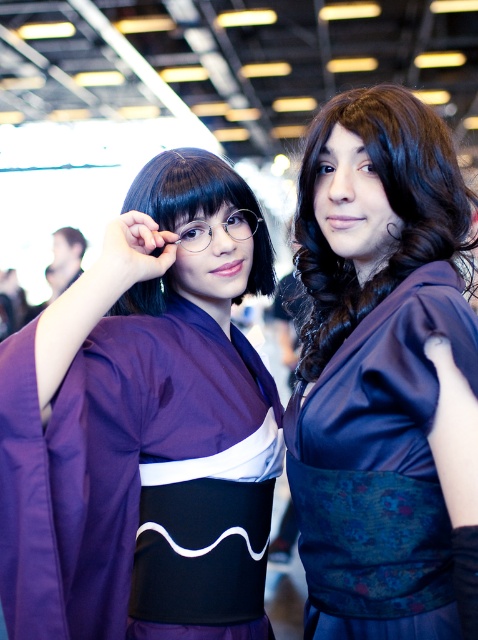
Question: Which object is closer to the camera taking this photo?

Choices:
 (A) satin purple kimono at center
 (B) matte purple kimono at left
 (C) matte black glasses at center

Answer: (A)

Question: Estimate the real-world distances between objects in this image. Which object is closer to the matte purple kimono at left?

Choices:
 (A) satin purple kimono at center
 (B) matte black glasses at center

Answer: (B)

Question: Does matte purple kimono at left appear on the left side of matte black glasses at center?

Choices:
 (A) yes
 (B) no

Answer: (A)

Question: Which point is farther to the camera?

Choices:
 (A) matte purple kimono at left
 (B) satin purple kimono at center
 (C) matte black glasses at center

Answer: (C)

Question: Is matte purple kimono at left to the right of matte black glasses at center from the viewer's perspective?

Choices:
 (A) yes
 (B) no

Answer: (B)

Question: Is satin purple kimono at center wider than matte black glasses at center?

Choices:
 (A) yes
 (B) no

Answer: (A)